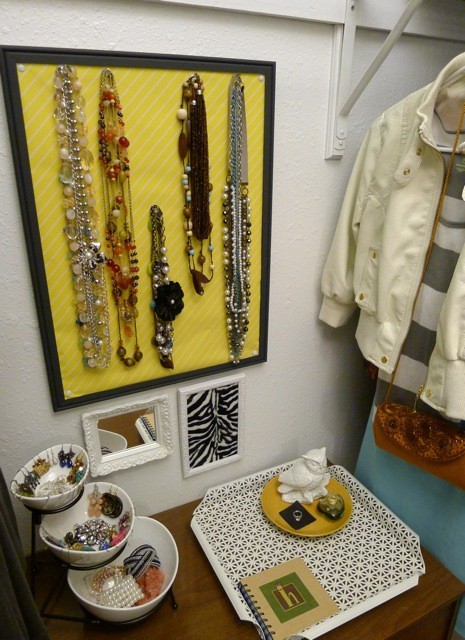
Find the location of a particular element. The image size is (465, 640). frame is located at coordinates (126, 461), (189, 386), (83, 399).